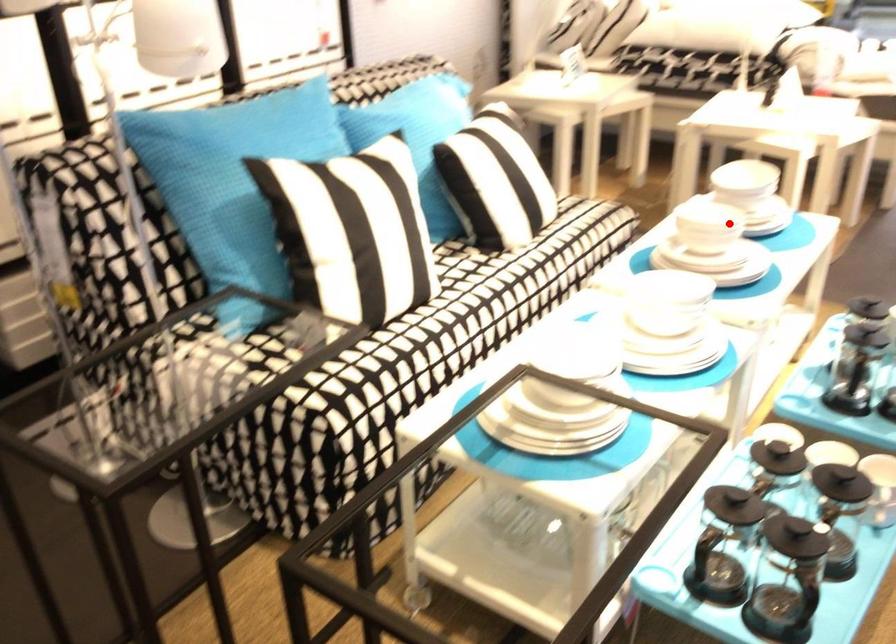
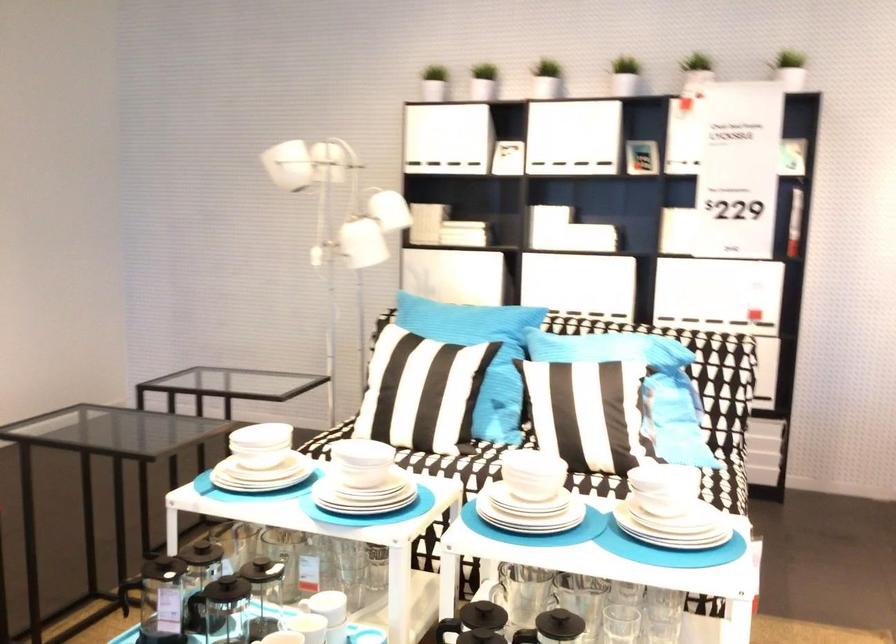
Locate, in the second image, the point that corresponds to the highlighted location in the first image.

(531, 474)